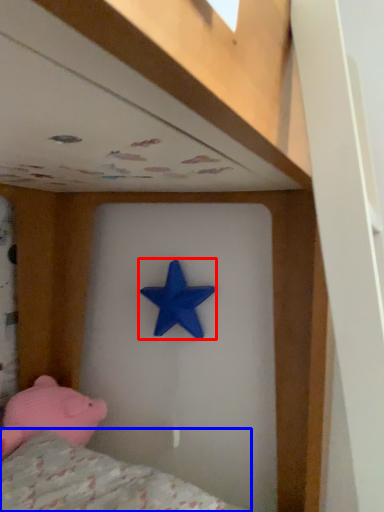
Question: Which object is closer to the camera taking this photo, starfish (highlighted by a red box) or mattress (highlighted by a blue box)?

Choices:
 (A) starfish
 (B) mattress

Answer: (B)